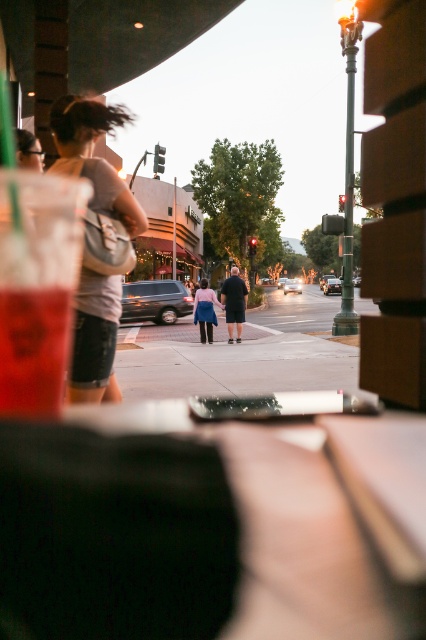
Question: Which point is closer to the camera?

Choices:
 (A) (218, 301)
 (B) (92, 112)

Answer: (B)

Question: Where is translucent glass beverage at lower left located in relation to pink fabric skirt at center in the image?

Choices:
 (A) right
 (B) left

Answer: (A)

Question: Is matte gray backpack at left wider than translucent glass beverage at lower left?

Choices:
 (A) yes
 (B) no

Answer: (A)

Question: Does translucent glass beverage at lower left appear on the right side of pink fabric skirt at center?

Choices:
 (A) yes
 (B) no

Answer: (A)

Question: Which point is closer to the camera?

Choices:
 (A) (203, 288)
 (B) (43, 353)
 (C) (106, 276)

Answer: (B)

Question: Which object is farther from the camera taking this photo?

Choices:
 (A) matte gray backpack at left
 (B) pink fabric skirt at center

Answer: (B)